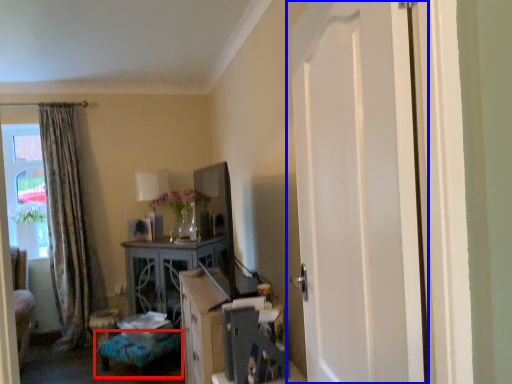
Question: Among these objects, which one is nearest to the camera, furniture (highlighted by a red box) or door (highlighted by a blue box)?

Choices:
 (A) furniture
 (B) door

Answer: (B)